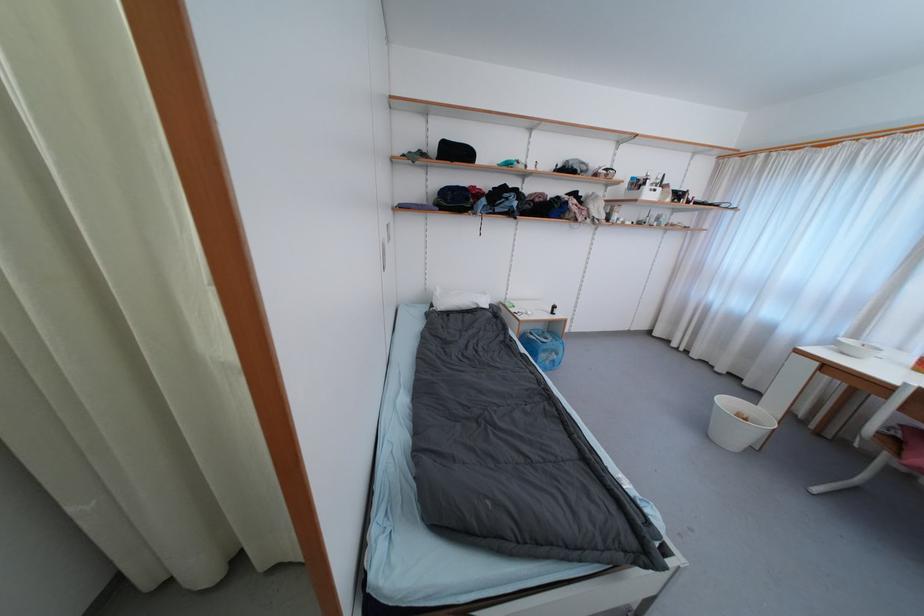
In order to click on dispenser pump in this screenshot , I will do `click(560, 312)`.